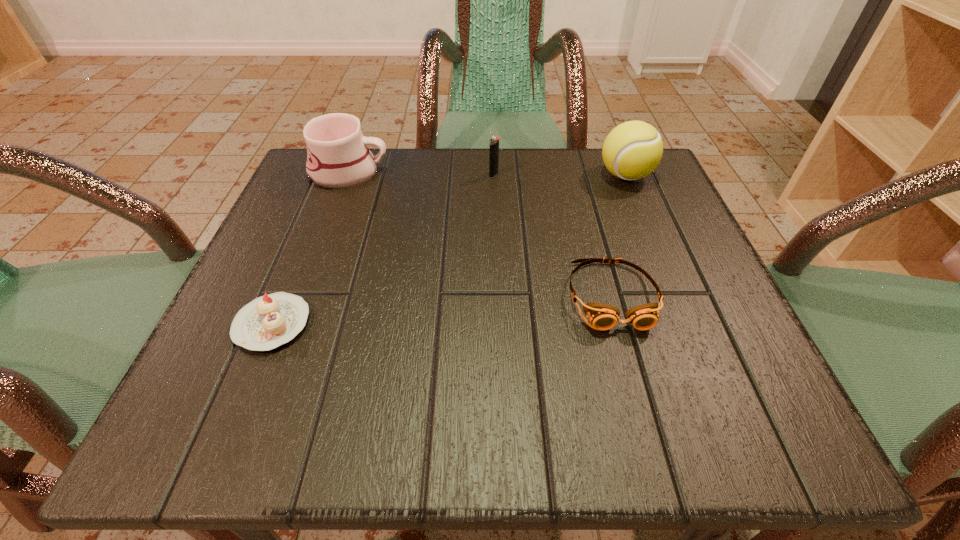
Where is `free space at the far edge of the desktop`? The image size is (960, 540). free space at the far edge of the desktop is located at coordinates (514, 212).

You are a GUI agent. You are given a task and a screenshot of the screen. Output one action in this format:
    pyautogui.click(x=<x>, y=<y>)
    Task: Click on the vacant space at the near edge
    The image size is (960, 540).
    Given the screenshot: What is the action you would take?
    pyautogui.click(x=622, y=412)

Image resolution: width=960 pixels, height=540 pixels. Identify the location of vacant space at the left edge of the desktop. (x=262, y=242).

The width and height of the screenshot is (960, 540). What are the coordinates of `free spot at the right edge of the desktop` in the screenshot? It's located at (721, 354).

You are a GUI agent. You are given a task and a screenshot of the screen. Output one action in this format:
    pyautogui.click(x=<x>, y=<y>)
    Task: Click on the free region at the far left corner
    
    Given the screenshot: What is the action you would take?
    pyautogui.click(x=348, y=205)

The height and width of the screenshot is (540, 960). Identify the location of free spot at the near left corner of the desktop. (169, 427).

I want to click on vacant area that lies between the igniter and the tennis ball, so click(x=560, y=176).

I want to click on empty location between the igniter and the cupcake, so click(383, 249).

This screenshot has width=960, height=540. I want to click on vacant space that's between the cupcake and the tennis ball, so click(x=449, y=249).

Locate an element on the screen. The width and height of the screenshot is (960, 540). empty location between the mug and the cupcake is located at coordinates (310, 248).